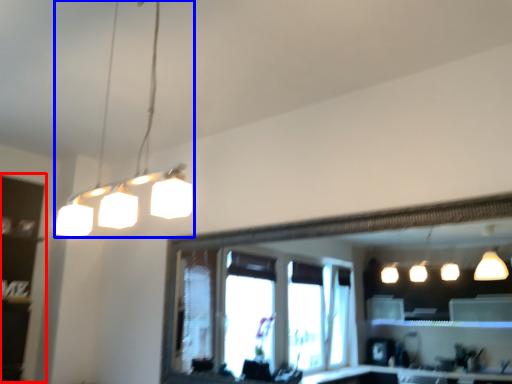
Question: Which point is closer to the camera, shelf (highlighted by a red box) or lamp (highlighted by a blue box)?

Choices:
 (A) shelf
 (B) lamp

Answer: (B)